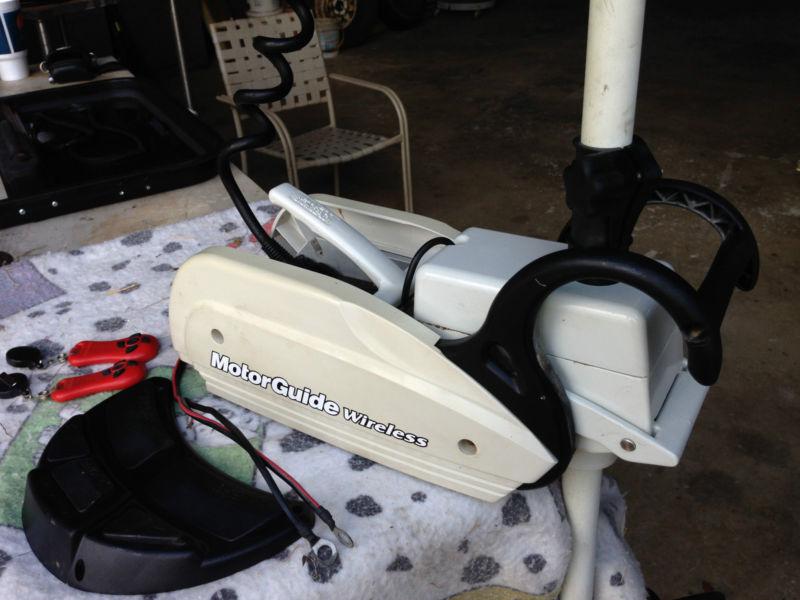
Find the location of a particular element. Image resolution: width=800 pixels, height=600 pixels. cable is located at coordinates 281,97.